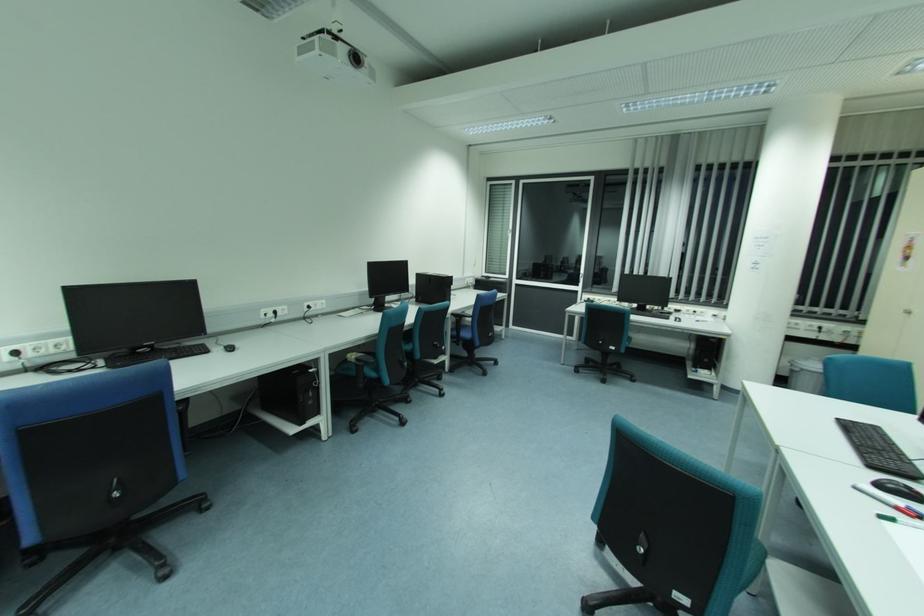
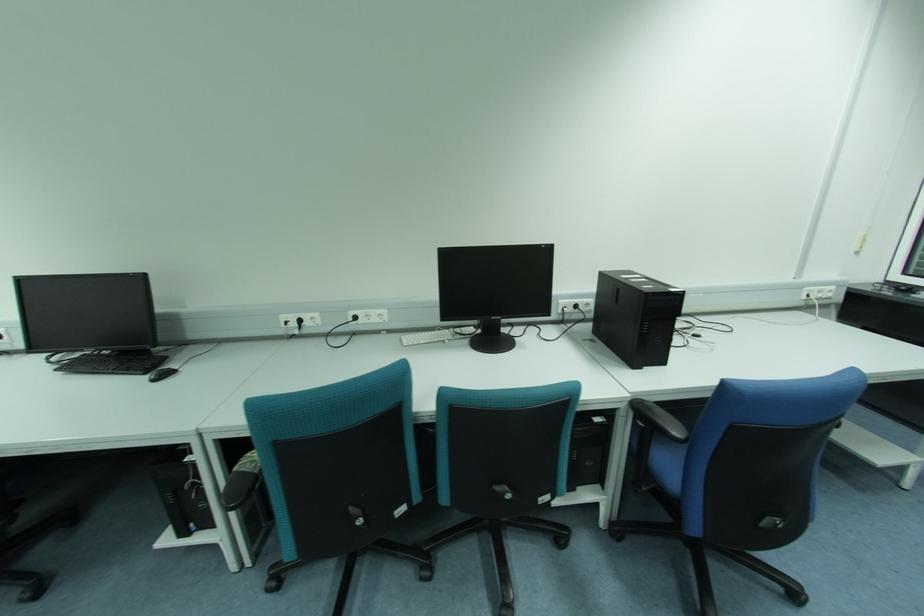
Find the pixel in the second image that matches (320,302) in the first image.

(374, 313)